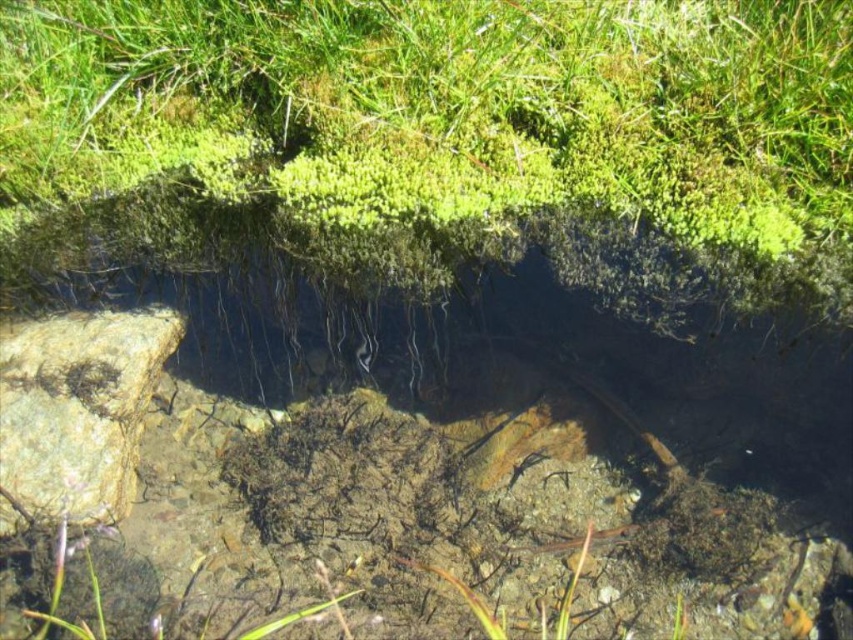
Question: Which point is farther to the camera?

Choices:
 (A) rough textured rock at left
 (B) green mossy grass at upper center

Answer: (A)

Question: Does green mossy grass at upper center appear on the right side of rough textured rock at left?

Choices:
 (A) no
 (B) yes

Answer: (B)

Question: Does green mossy grass at upper center have a smaller size compared to rough textured rock at left?

Choices:
 (A) no
 (B) yes

Answer: (A)

Question: Observing the image, what is the correct spatial positioning of green mossy grass at upper center in reference to rough textured rock at left?

Choices:
 (A) above
 (B) below

Answer: (A)

Question: Which of the following is the farthest from the observer?

Choices:
 (A) (71, 339)
 (B) (64, 72)

Answer: (A)